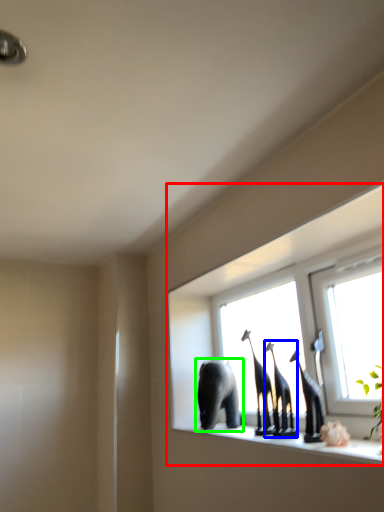
Question: Considering the real-world distances, which object is closest to window (highlighted by a red box)? animal (highlighted by a blue box) or elephant (highlighted by a green box).

Choices:
 (A) animal
 (B) elephant

Answer: (B)